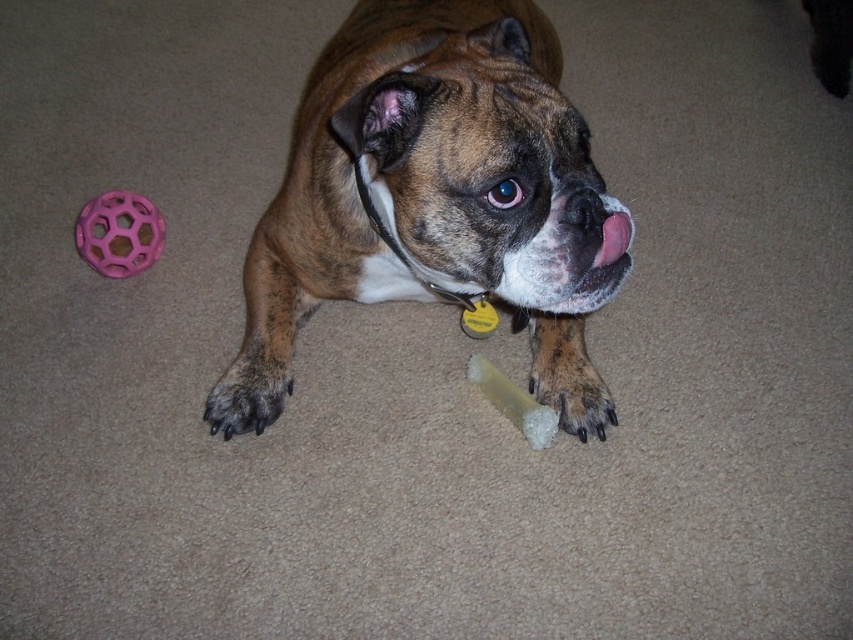
In the scene shown: Which is below, brown matte dog at center or pink rubber ball at upper left?

pink rubber ball at upper left is below.

Is point (439, 40) less distant than point (610, 252)?

No, (439, 40) is further to viewer.

Identify the location of brown matte dog at center. (432, 198).